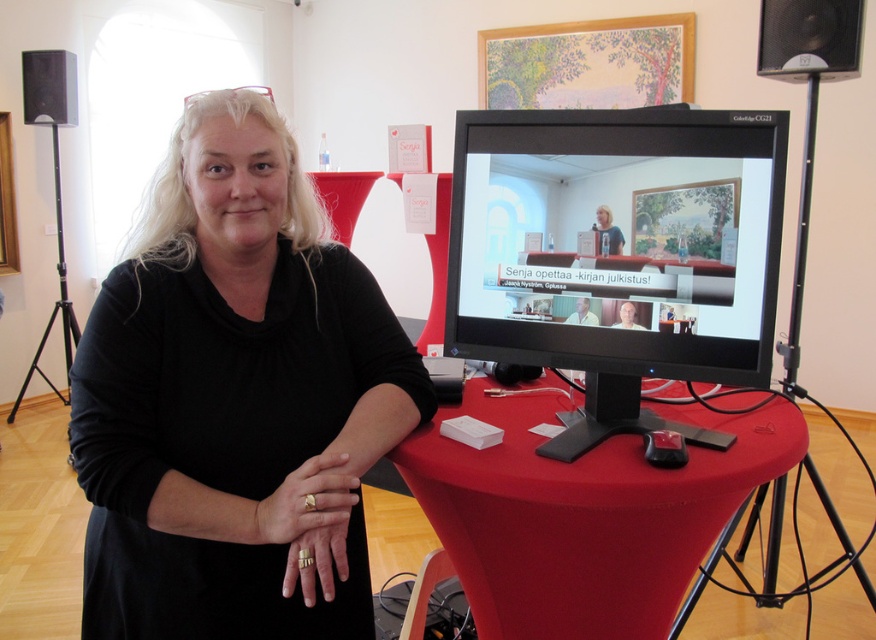
Question: Estimate the real-world distances between objects in this image. Which object is farther from the black plastic speaker at upper right?

Choices:
 (A) black plastic speaker at upper left
 (B) smooth red table at center
 (C) matte black monitor at center

Answer: (A)

Question: Among these points, which one is nearest to the camera?

Choices:
 (A) click(x=453, y=307)
 (B) click(x=811, y=36)

Answer: (A)

Question: Does matte black monitor at center appear on the right side of smooth red table at center?

Choices:
 (A) no
 (B) yes

Answer: (A)

Question: Can you confirm if matte black monitor at center is positioned to the right of black plastic speaker at upper right?

Choices:
 (A) yes
 (B) no

Answer: (B)

Question: Which of these objects is positioned farthest from the smooth red table at center?

Choices:
 (A) black plastic speaker at upper left
 (B) black matte dress at center
 (C) matte black monitor at center

Answer: (A)

Question: Is black matte dress at center above smooth red table at center?

Choices:
 (A) yes
 (B) no

Answer: (A)